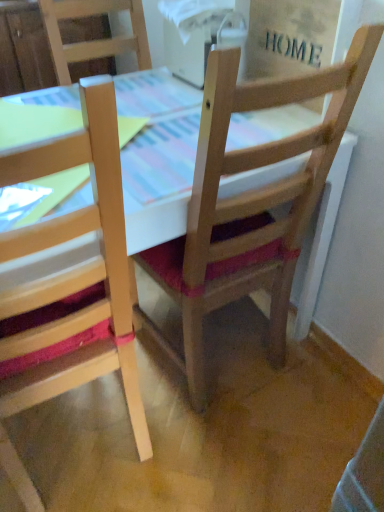
In order to face wooden table at center, should I rotate leftwards or rightwards?

Turn left approximately 9.562 degrees to face it.

The height and width of the screenshot is (512, 384). I want to click on wooden chair at center, acting as the 2th chair starting from the left, so click(x=250, y=202).

Find the location of `natural wood chair at left, the second chair viewed from the right`. natural wood chair at left, the second chair viewed from the right is located at coordinates (67, 284).

Which point is more forward, (44, 336) or (204, 287)?

The point (44, 336) is in front.

Who is more distant, natural wood chair at left, the second chair viewed from the right, or wooden chair at center, acting as the 2th chair starting from the left?

wooden chair at center, acting as the 2th chair starting from the left, is more distant.

From the image's perspective, which one is positioned lower, natural wood chair at left, placed as the first chair when sorted from left to right, or wooden chair at center, which is the 1th chair in right-to-left order?

natural wood chair at left, placed as the first chair when sorted from left to right, is shown below in the image.

Image resolution: width=384 pixels, height=512 pixels. Find the location of `chair below the wooden chair at center, which is the 1th chair in right-to-left order (from a real-world perspective)`. chair below the wooden chair at center, which is the 1th chair in right-to-left order (from a real-world perspective) is located at coordinates (67, 284).

Considering the relative sizes of natural wood chair at left, placed as the first chair when sorted from left to right, and wooden table at center in the image provided, is natural wood chair at left, placed as the first chair when sorted from left to right, wider than wooden table at center?

In fact, natural wood chair at left, placed as the first chair when sorted from left to right, might be narrower than wooden table at center.

Based on the photo, between natural wood chair at left, placed as the first chair when sorted from left to right, and wooden table at center, which one is positioned in front?

Positioned in front is natural wood chair at left, placed as the first chair when sorted from left to right.

Considering the sizes of objects natural wood chair at left, placed as the first chair when sorted from left to right, and wooden table at center in the image provided, who is smaller, natural wood chair at left, placed as the first chair when sorted from left to right, or wooden table at center?

Smaller between the two is natural wood chair at left, placed as the first chair when sorted from left to right.

Looking at this image, is natural wood chair at left, placed as the first chair when sorted from left to right, surrounding wooden table at center?

Definitely not — wooden table at center is not inside natural wood chair at left, placed as the first chair when sorted from left to right.

Looking at their sizes, would you say wooden table at center is wider or thinner than natural wood chair at left, the second chair viewed from the right?

In the image, wooden table at center appears to be wider than natural wood chair at left, the second chair viewed from the right.

From the image's perspective, relative to natural wood chair at left, placed as the first chair when sorted from left to right, is wooden table at center above or below?

wooden table at center is situated higher than natural wood chair at left, placed as the first chair when sorted from left to right, in the image.

Which is behind, wooden table at center or natural wood chair at left, the second chair viewed from the right?

wooden table at center is more distant.

Do you think wooden chair at center, acting as the 2th chair starting from the left, is within natural wood chair at left, the second chair viewed from the right, or outside of it?

wooden chair at center, acting as the 2th chair starting from the left, is not enclosed by natural wood chair at left, the second chair viewed from the right.

Which of these two, wooden chair at center, which is the 1th chair in right-to-left order, or natural wood chair at left, the second chair viewed from the right, is bigger?

Bigger between the two is natural wood chair at left, the second chair viewed from the right.

Considering the sizes of objects wooden chair at center, acting as the 2th chair starting from the left, and natural wood chair at left, the second chair viewed from the right, in the image provided, who is taller, wooden chair at center, acting as the 2th chair starting from the left, or natural wood chair at left, the second chair viewed from the right,?

natural wood chair at left, the second chair viewed from the right, is taller.

Can you tell me how much wooden chair at center, which is the 1th chair in right-to-left order, and natural wood chair at left, placed as the first chair when sorted from left to right, differ in facing direction?

There is a 3.3-degree angle between the facing directions of wooden chair at center, which is the 1th chair in right-to-left order, and natural wood chair at left, placed as the first chair when sorted from left to right.

Is wooden table at center beside wooden chair at center, acting as the 2th chair starting from the left?

No, wooden table at center is not in contact with wooden chair at center, acting as the 2th chair starting from the left.

Is wooden table at center taller than wooden chair at center, which is the 1th chair in right-to-left order?

Incorrect, the height of wooden table at center is not larger of that of wooden chair at center, which is the 1th chair in right-to-left order.

Considering the sizes of objects wooden table at center and wooden chair at center, acting as the 2th chair starting from the left, in the image provided, who is smaller, wooden table at center or wooden chair at center, acting as the 2th chair starting from the left,?

Smaller between the two is wooden chair at center, acting as the 2th chair starting from the left.

Considering the relative sizes of wooden chair at center, acting as the 2th chair starting from the left, and wooden table at center in the image provided, is wooden chair at center, acting as the 2th chair starting from the left, thinner than wooden table at center?

Correct, the width of wooden chair at center, acting as the 2th chair starting from the left, is less than that of wooden table at center.

From a real-world perspective, between wooden chair at center, acting as the 2th chair starting from the left, and wooden table at center, who is vertically lower?

wooden table at center.

Could you tell me if wooden chair at center, acting as the 2th chair starting from the left, is facing wooden table at center?

Yes, wooden chair at center, acting as the 2th chair starting from the left, is oriented towards wooden table at center.

Find the location of a particular element. the 2nd chair above the wooden table at center (from a real-world perspective) is located at coordinates (250, 202).

Where is `chair located in front of the wooden chair at center, which is the 1th chair in right-to-left order`? chair located in front of the wooden chair at center, which is the 1th chair in right-to-left order is located at coordinates (67, 284).

Where is `chair below the wooden table at center (from the image's perspective)`? chair below the wooden table at center (from the image's perspective) is located at coordinates (67, 284).

Looking at the image, which one is located further to natural wood chair at left, the second chair viewed from the right, wooden table at center or wooden chair at center, acting as the 2th chair starting from the left?

Based on the image, wooden table at center appears to be further to natural wood chair at left, the second chair viewed from the right.

Based on their spatial positions, is natural wood chair at left, the second chair viewed from the right, or wooden table at center closer to wooden chair at center, which is the 1th chair in right-to-left order?

wooden table at center is closer to wooden chair at center, which is the 1th chair in right-to-left order.

Based on their spatial positions, is wooden chair at center, which is the 1th chair in right-to-left order, or natural wood chair at left, the second chair viewed from the right, further from wooden table at center?

natural wood chair at left, the second chair viewed from the right, lies further to wooden table at center than the other object.

Based on their spatial positions, is wooden table at center or natural wood chair at left, the second chair viewed from the right, further from wooden chair at center, which is the 1th chair in right-to-left order?

Among the two, natural wood chair at left, the second chair viewed from the right, is located further to wooden chair at center, which is the 1th chair in right-to-left order.

Estimate the real-world distances between objects in this image. Which object is closer to natural wood chair at left, the second chair viewed from the right, wooden chair at center, acting as the 2th chair starting from the left, or wooden table at center?

wooden chair at center, acting as the 2th chair starting from the left, is closer to natural wood chair at left, the second chair viewed from the right.

Based on their spatial positions, is natural wood chair at left, the second chair viewed from the right, or wooden chair at center, acting as the 2th chair starting from the left, further from wooden table at center?

Based on the image, natural wood chair at left, the second chair viewed from the right, appears to be further to wooden table at center.

Image resolution: width=384 pixels, height=512 pixels. Find the location of `table between natural wood chair at left, placed as the first chair when sorted from left to right, and wooden chair at center, acting as the 2th chair starting from the left, in the horizontal direction`. table between natural wood chair at left, placed as the first chair when sorted from left to right, and wooden chair at center, acting as the 2th chair starting from the left, in the horizontal direction is located at coordinates (158, 156).